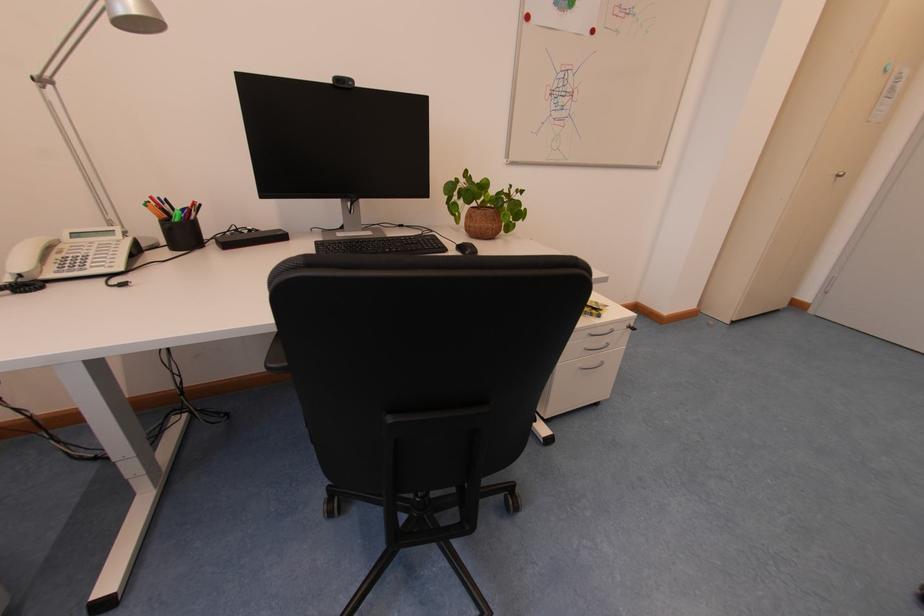
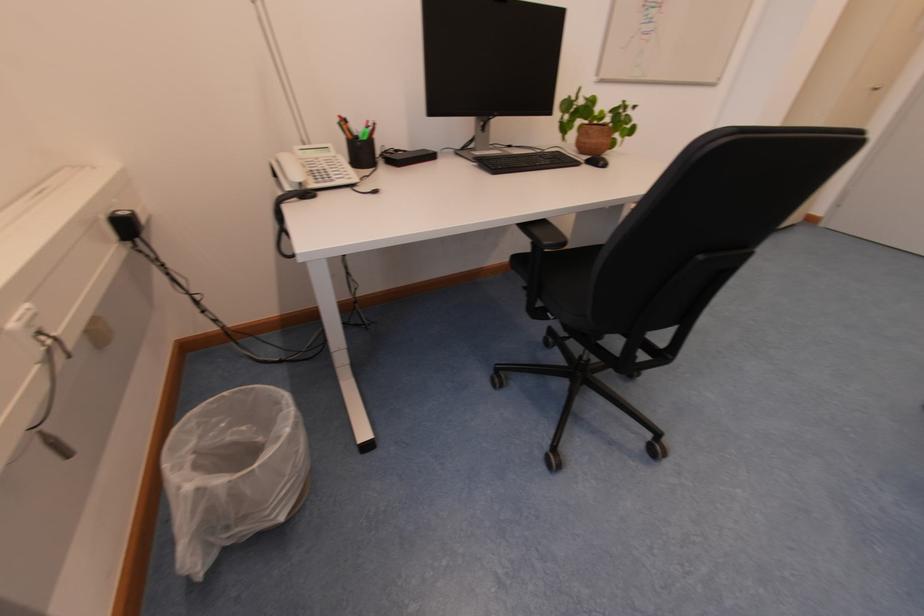
Where in the second image is the point corresponding to (x=457, y=190) from the first image?

(575, 108)